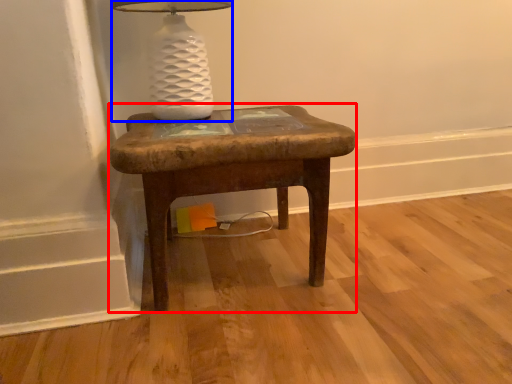
Question: Which of the following is the farthest to the observer, stool (highlighted by a red box) or table lamp (highlighted by a blue box)?

Choices:
 (A) stool
 (B) table lamp

Answer: (B)